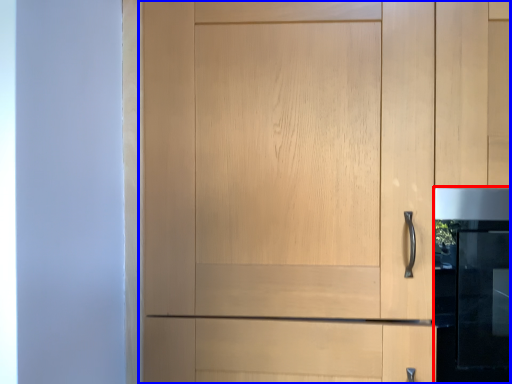
Question: Which point is closer to the camera, oven (highlighted by a red box) or cupboard (highlighted by a blue box)?

Choices:
 (A) oven
 (B) cupboard

Answer: (B)